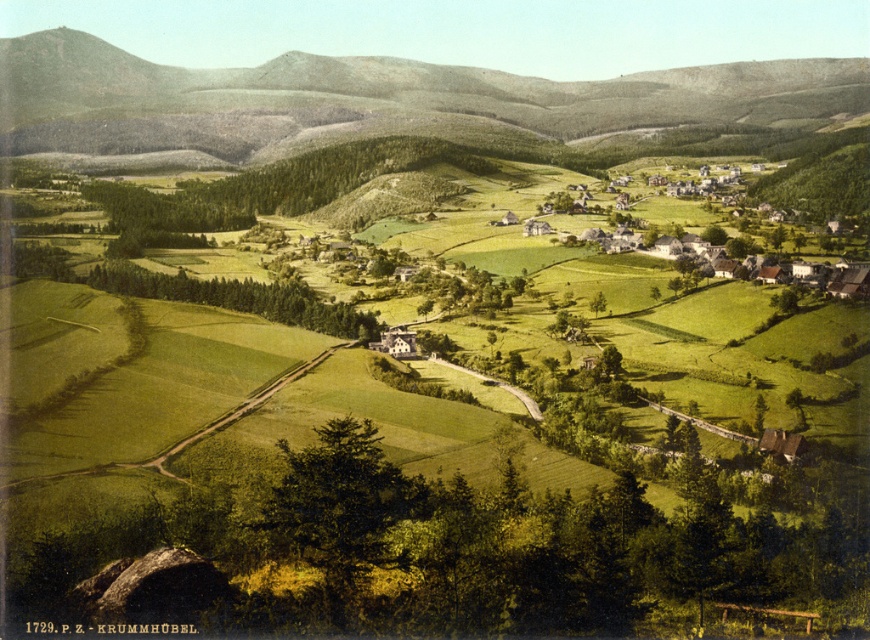
Which is below, green textured hillside at upper center or white thatched-roof houses at center-right?

Positioned lower is white thatched-roof houses at center-right.

Is point (209, 88) positioned in front of point (730, 205)?

No, (209, 88) is further to viewer.

Between point (505, 122) and point (633, 236), which one is positioned behind?

Point (505, 122)

Where is `green textured hillside at upper center`? green textured hillside at upper center is located at coordinates (372, 99).